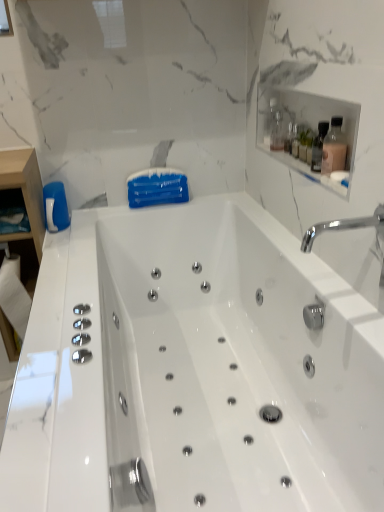
Question: From a real-world perspective, is matte pink glass bottle at upper right, which is counted as the first bottle, starting from the right, physically above clear glass bottle at upper right, acting as the 1th bottle starting from the back?

Choices:
 (A) yes
 (B) no

Answer: (A)

Question: Considering the relative positions of matte pink glass bottle at upper right, the first bottle in the bottom-to-top sequence, and clear glass bottle at upper right, positioned as the first bottle in top-to-bottom order, in the image provided, is matte pink glass bottle at upper right, the first bottle in the bottom-to-top sequence, to the left of clear glass bottle at upper right, positioned as the first bottle in top-to-bottom order, from the viewer's perspective?

Choices:
 (A) yes
 (B) no

Answer: (B)

Question: Can you confirm if matte pink glass bottle at upper right, which is counted as the first bottle, starting from the front, is wider than clear glass bottle at upper right, positioned as the first bottle in left-to-right order?

Choices:
 (A) yes
 (B) no

Answer: (B)

Question: Is matte pink glass bottle at upper right, the first bottle in the bottom-to-top sequence, far away from clear glass bottle at upper right, positioned as the first bottle in top-to-bottom order?

Choices:
 (A) yes
 (B) no

Answer: (B)

Question: Is the surface of matte pink glass bottle at upper right, which is counted as the first bottle, starting from the right, in direct contact with clear glass bottle at upper right, acting as the second bottle starting from the front?

Choices:
 (A) no
 (B) yes

Answer: (A)

Question: Does matte pink glass bottle at upper right, arranged as the second bottle when viewed from the back, have a larger size compared to clear glass bottle at upper right, marked as the 2th bottle in a right-to-left arrangement?

Choices:
 (A) yes
 (B) no

Answer: (A)

Question: Can you confirm if clear glass bottle at upper right, positioned as the first bottle in left-to-right order, is smaller than clear glass shelf at upper right?

Choices:
 (A) yes
 (B) no

Answer: (A)

Question: Is clear glass shelf at upper right located within clear glass bottle at upper right, acting as the second bottle starting from the front?

Choices:
 (A) yes
 (B) no

Answer: (B)

Question: Are clear glass bottle at upper right, marked as the 2th bottle in a right-to-left arrangement, and clear glass shelf at upper right beside each other?

Choices:
 (A) no
 (B) yes

Answer: (A)

Question: Is clear glass bottle at upper right, acting as the second bottle starting from the front, facing towards clear glass shelf at upper right?

Choices:
 (A) yes
 (B) no

Answer: (B)

Question: Considering the relative sizes of clear glass bottle at upper right, positioned as the first bottle in left-to-right order, and clear glass shelf at upper right in the image provided, is clear glass bottle at upper right, positioned as the first bottle in left-to-right order, shorter than clear glass shelf at upper right?

Choices:
 (A) no
 (B) yes

Answer: (A)

Question: Can you confirm if clear glass bottle at upper right, acting as the second bottle starting from the front, is thinner than clear glass shelf at upper right?

Choices:
 (A) yes
 (B) no

Answer: (A)

Question: Can you confirm if clear glass bottle at upper right, acting as the second bottle starting from the front, is bigger than white glossy bathtub at center?

Choices:
 (A) yes
 (B) no

Answer: (B)